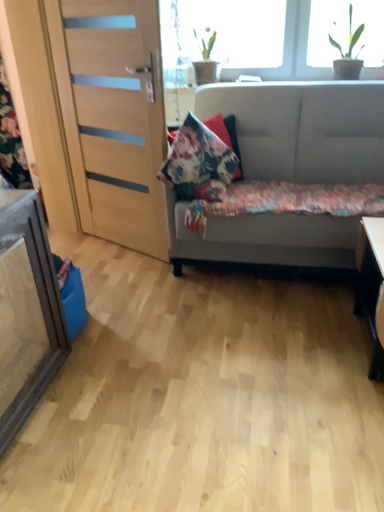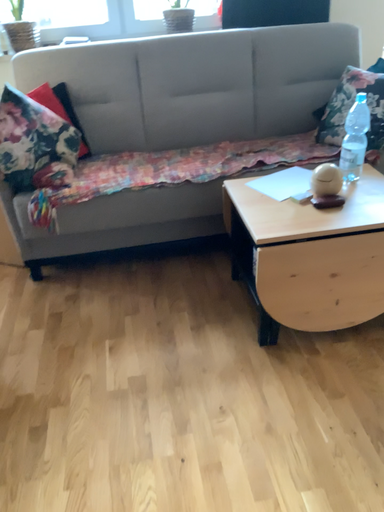
Question: Which way did the camera rotate in the video?

Choices:
 (A) rotated right
 (B) rotated left

Answer: (A)